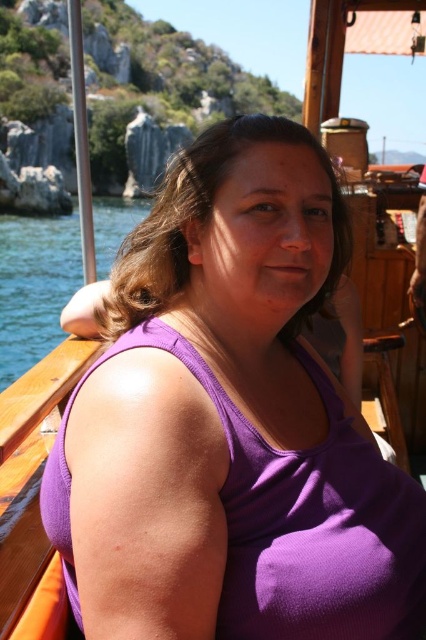
You are a fashion designer analyzing the positioning of clothing items in a photo. In the image, where is the purple fabric tank top at center located in terms of coordinates?

The purple fabric tank top at center is located at coordinates point (230, 422).

Consider the image. You are standing on the boat and want to reach the point at coordinates point at (409, 481). If you can jump 6 meters, will you be able to reach it?

The distance between you and the point at (409, 481) is 6.25 meters, so you cannot reach it with a 6 meter jump.

You are a photographer planning to take a portrait of the person wearing the purple fabric tank top at center. You want to ensure the blue water at left is visible in the background. Given the distance between them, will you need to adjust your camera settings to capture both clearly in focus?

The purple fabric tank top at center is 351.51 feet from the blue water at left. Since the distance between them is quite large, you will need to adjust your camera settings to ensure both are in focus, possibly using a smaller aperture for a greater depth of field.